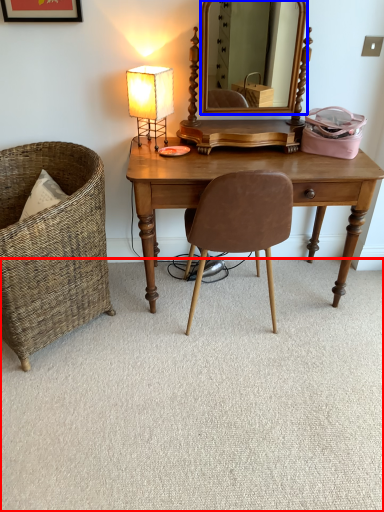
Question: Which point is further to the camera, plain (highlighted by a red box) or mirror (highlighted by a blue box)?

Choices:
 (A) plain
 (B) mirror

Answer: (B)